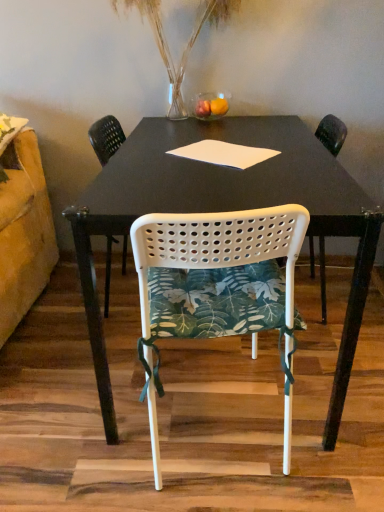
Question: Is translucent glass vase at upper center to the right of white perforated plastic chair at center, marked as the second chair in a back-to-front arrangement, from the viewer's perspective?

Choices:
 (A) yes
 (B) no

Answer: (B)

Question: Does translucent glass vase at upper center have a lesser height compared to white perforated plastic chair at center, marked as the second chair in a back-to-front arrangement?

Choices:
 (A) yes
 (B) no

Answer: (B)

Question: Could you tell me if translucent glass vase at upper center is facing white perforated plastic chair at center, marked as the second chair in a back-to-front arrangement?

Choices:
 (A) yes
 (B) no

Answer: (B)

Question: From the image's perspective, is translucent glass vase at upper center over white perforated plastic chair at center, marked as the second chair in a back-to-front arrangement?

Choices:
 (A) yes
 (B) no

Answer: (A)

Question: Is translucent glass vase at upper center not within white perforated plastic chair at center, marked as the second chair in a back-to-front arrangement?

Choices:
 (A) no
 (B) yes

Answer: (B)

Question: Is translucent glass vase at upper center situated inside white matte table at center or outside?

Choices:
 (A) inside
 (B) outside

Answer: (B)

Question: Relative to white matte table at center, is translucent glass vase at upper center in front or behind?

Choices:
 (A) behind
 (B) front

Answer: (A)

Question: Would you say translucent glass vase at upper center is to the left or to the right of white matte table at center in the picture?

Choices:
 (A) right
 (B) left

Answer: (B)

Question: From a real-world perspective, is translucent glass vase at upper center above or below white matte table at center?

Choices:
 (A) above
 (B) below

Answer: (A)

Question: From the image's perspective, is white paper at center above or below white matte table at center?

Choices:
 (A) above
 (B) below

Answer: (A)

Question: Considering the positions of white paper at center and white matte table at center in the image, is white paper at center wider or thinner than white matte table at center?

Choices:
 (A) thin
 (B) wide

Answer: (A)

Question: Is white paper at center taller or shorter than white matte table at center?

Choices:
 (A) tall
 (B) short

Answer: (B)

Question: From a real-world perspective, relative to white matte table at center, is white paper at center vertically above or below?

Choices:
 (A) below
 (B) above

Answer: (B)

Question: Considering the positions of white perforated plastic chair at center, the 2th chair positioned from the front, and white matte table at center in the image, is white perforated plastic chair at center, the 2th chair positioned from the front, wider or thinner than white matte table at center?

Choices:
 (A) thin
 (B) wide

Answer: (A)

Question: Is point (102, 146) positioned closer to the camera than point (238, 142)?

Choices:
 (A) closer
 (B) farther

Answer: (B)